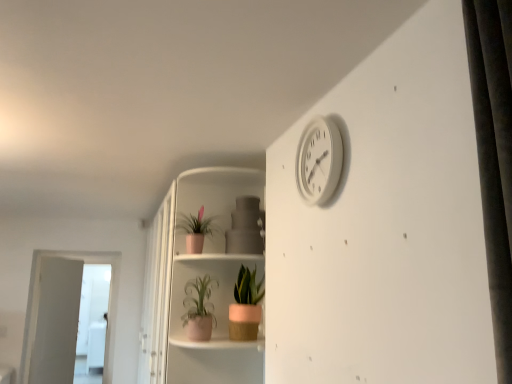
Question: From a real-world perspective, is pink matte pot at lower center, positioned as the first houseplant in right-to-left order, above or below white glossy screen door at lower left, positioned as the first screen door in back-to-front order?

Choices:
 (A) below
 (B) above

Answer: (B)

Question: Do you think pink matte pot at lower center, positioned as the first houseplant in right-to-left order, is within white glossy screen door at lower left, positioned as the first screen door in back-to-front order, or outside of it?

Choices:
 (A) inside
 (B) outside

Answer: (B)

Question: Estimate the real-world distances between objects in this image. Which object is farther from the white plastic clock at upper right?

Choices:
 (A) pink matte pot at lower center, positioned as the first houseplant in right-to-left order
 (B) white glossy screen door at lower left, positioned as the first screen door in back-to-front order
 (C) white glossy screen door at left, which appears as the 2th screen door when viewed from the left
 (D) matte white shelf at center
 (E) matte pink pot at lower center, arranged as the 2th houseplant when viewed from the left

Answer: (B)

Question: Estimate the real-world distances between objects in this image. Which object is farther from the white plastic clock at upper right?

Choices:
 (A) pink matte pot at lower center, placed as the third houseplant when sorted from left to right
 (B) white glossy screen door at left, which is counted as the 1th screen door, starting from the right
 (C) white glossy screen door at lower left, placed as the 2th screen door when sorted from right to left
 (D) pink matte pot at upper center, which is the 3th houseplant in right-to-left order
 (E) matte pink pot at lower center, acting as the 2th houseplant starting from the right

Answer: (C)